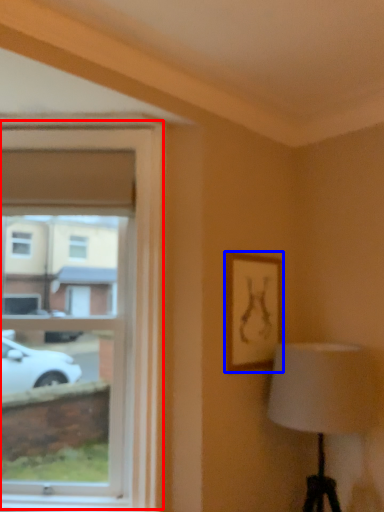
Question: Which point is further to the camera, window (highlighted by a red box) or picture frame (highlighted by a blue box)?

Choices:
 (A) window
 (B) picture frame

Answer: (B)